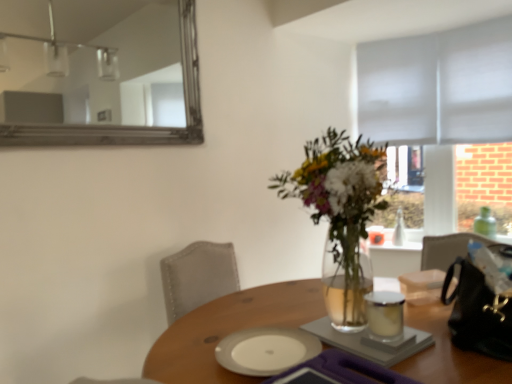
Question: Is gray fabric blind at upper right at the left side of wooden table at center?

Choices:
 (A) yes
 (B) no

Answer: (B)

Question: Does gray fabric blind at upper right appear on the right side of wooden table at center?

Choices:
 (A) yes
 (B) no

Answer: (A)

Question: Can wooden table at center be found inside gray fabric blind at upper right?

Choices:
 (A) no
 (B) yes

Answer: (A)

Question: Is gray fabric blind at upper right shorter than wooden table at center?

Choices:
 (A) yes
 (B) no

Answer: (B)

Question: Is the position of gray fabric blind at upper right more distant than that of wooden table at center?

Choices:
 (A) no
 (B) yes

Answer: (B)

Question: Is silver-framed mirror at upper left wider or thinner than translucent glass vase at center?

Choices:
 (A) thin
 (B) wide

Answer: (A)

Question: In terms of size, does silver-framed mirror at upper left appear bigger or smaller than translucent glass vase at center?

Choices:
 (A) small
 (B) big

Answer: (A)

Question: In terms of height, does silver-framed mirror at upper left look taller or shorter compared to translucent glass vase at center?

Choices:
 (A) short
 (B) tall

Answer: (B)

Question: From the image's perspective, is silver-framed mirror at upper left located above or below translucent glass vase at center?

Choices:
 (A) below
 (B) above

Answer: (B)

Question: Looking at the image, does gray fabric blind at upper right seem bigger or smaller compared to translucent glass vase at center?

Choices:
 (A) big
 (B) small

Answer: (B)

Question: Is gray fabric blind at upper right wider or thinner than translucent glass vase at center?

Choices:
 (A) wide
 (B) thin

Answer: (B)

Question: From the image's perspective, is gray fabric blind at upper right located above or below translucent glass vase at center?

Choices:
 (A) below
 (B) above

Answer: (B)

Question: In terms of height, does gray fabric blind at upper right look taller or shorter compared to translucent glass vase at center?

Choices:
 (A) tall
 (B) short

Answer: (A)

Question: In terms of size, does white ceramic plate at center, which is counted as the 2th tableware, starting from the top, appear bigger or smaller than white glossy candle at center, marked as the second tableware in a bottom-to-top arrangement?

Choices:
 (A) small
 (B) big

Answer: (B)

Question: Is white ceramic plate at center, marked as the 2th tableware in a right-to-left arrangement, inside the boundaries of white glossy candle at center, which appears as the second tableware when viewed from the left, or outside?

Choices:
 (A) outside
 (B) inside

Answer: (A)